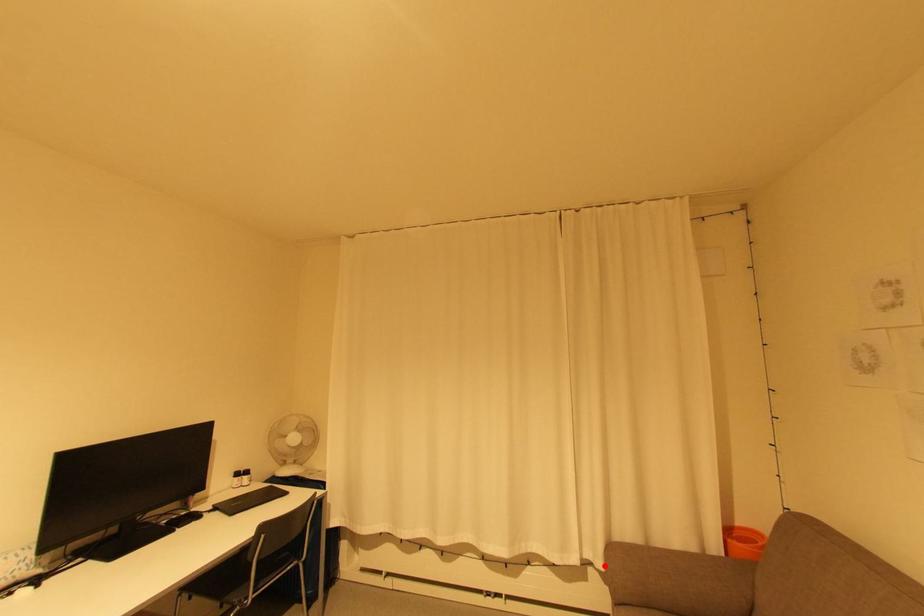
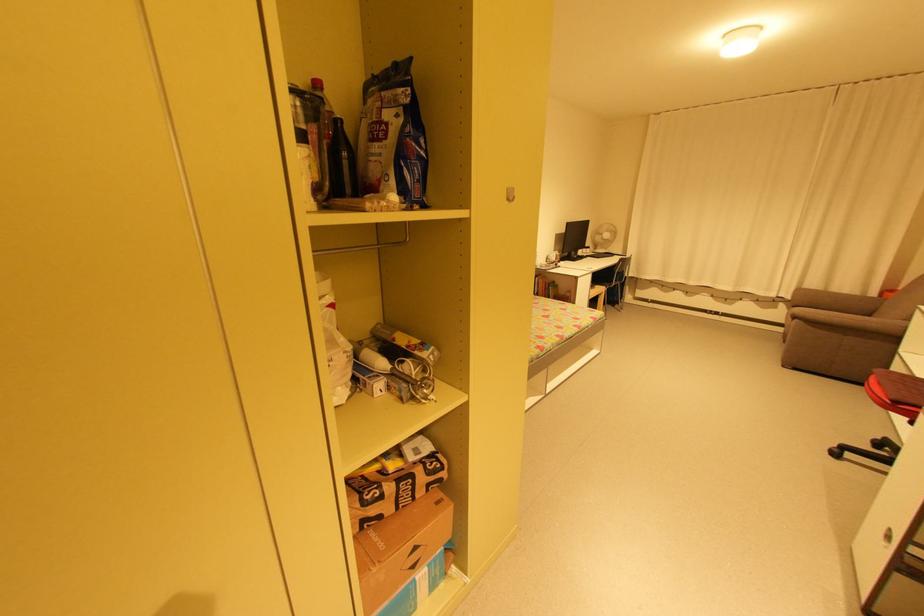
Locate, in the second image, the point that corresponds to the highlighted location in the first image.

(794, 297)